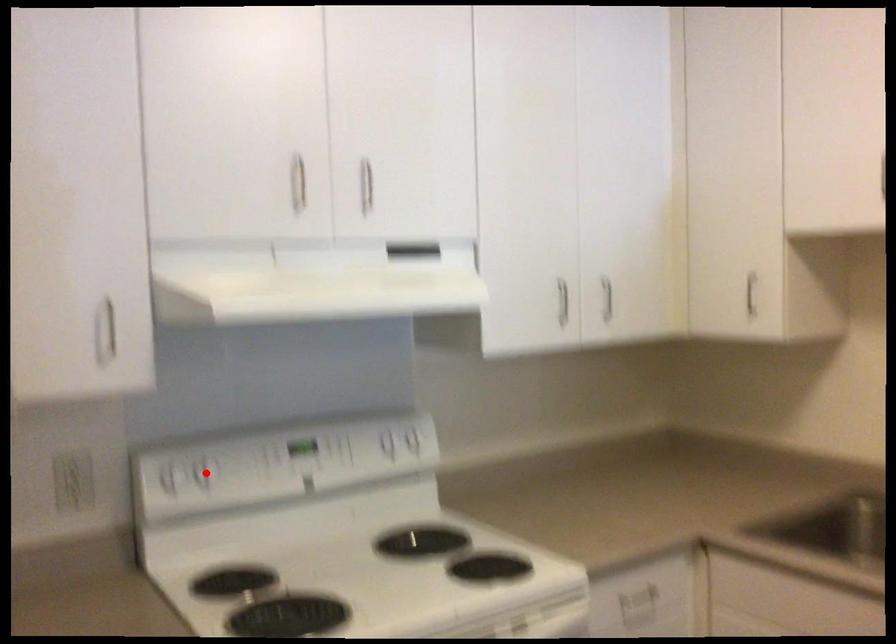
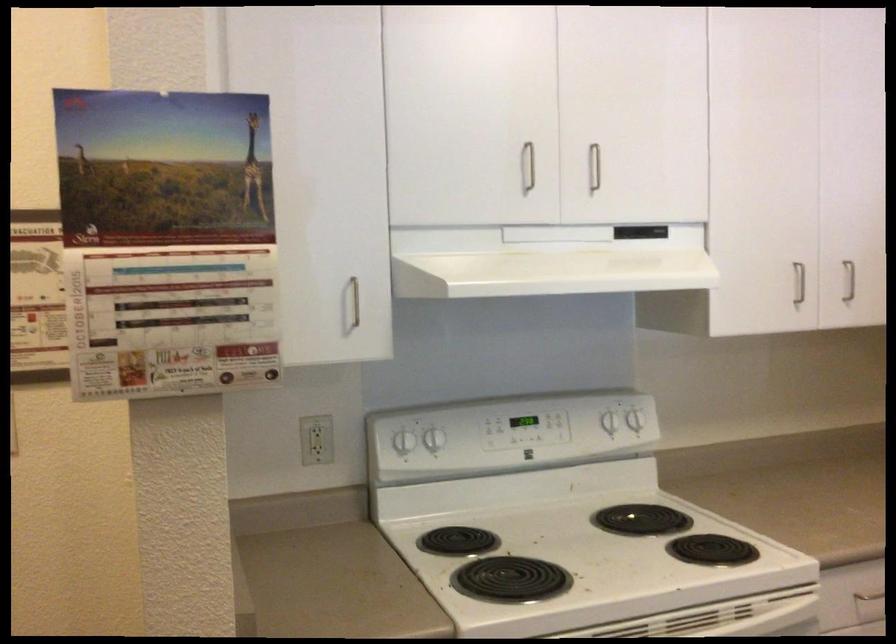
Find the pixel in the second image that matches the highlighted location in the first image.

(435, 439)